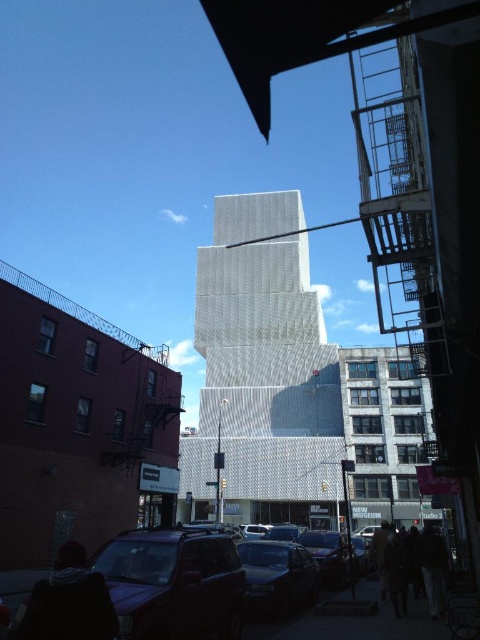
Between matte black suv at lower left and dark gray hoodie at lower left, which one has less height?

matte black suv at lower left is shorter.

Is matte black suv at lower left thinner than dark gray hoodie at lower left?

Yes.

Is point (186, 637) in front of point (20, 625)?

No, it is not.

Where is `matte black suv at lower left`? Image resolution: width=480 pixels, height=640 pixels. matte black suv at lower left is located at coordinates (173, 582).

From the picture: Does matte black suv at lower left have a larger size compared to metallic silver car at center?

Indeed, matte black suv at lower left has a larger size compared to metallic silver car at center.

Can you confirm if matte black suv at lower left is wider than metallic silver car at center?

Yes, matte black suv at lower left is wider than metallic silver car at center.

Where is `matte black suv at lower left`? This screenshot has width=480, height=640. matte black suv at lower left is located at coordinates (173, 582).

Image resolution: width=480 pixels, height=640 pixels. What do you see at coordinates (69, 602) in the screenshot?
I see `dark gray hoodie at lower left` at bounding box center [69, 602].

Is dark gray hoodie at lower left positioned at the back of metallic silver car at center?

That is False.

This screenshot has height=640, width=480. What are the coordinates of `dark gray hoodie at lower left` in the screenshot? It's located at (69, 602).

You are a GUI agent. You are given a task and a screenshot of the screen. Output one action in this format:
    pyautogui.click(x=<x>, y=<y>)
    Task: Click on the dark gray hoodie at lower left
    This screenshot has width=480, height=640.
    Given the screenshot: What is the action you would take?
    pyautogui.click(x=69, y=602)